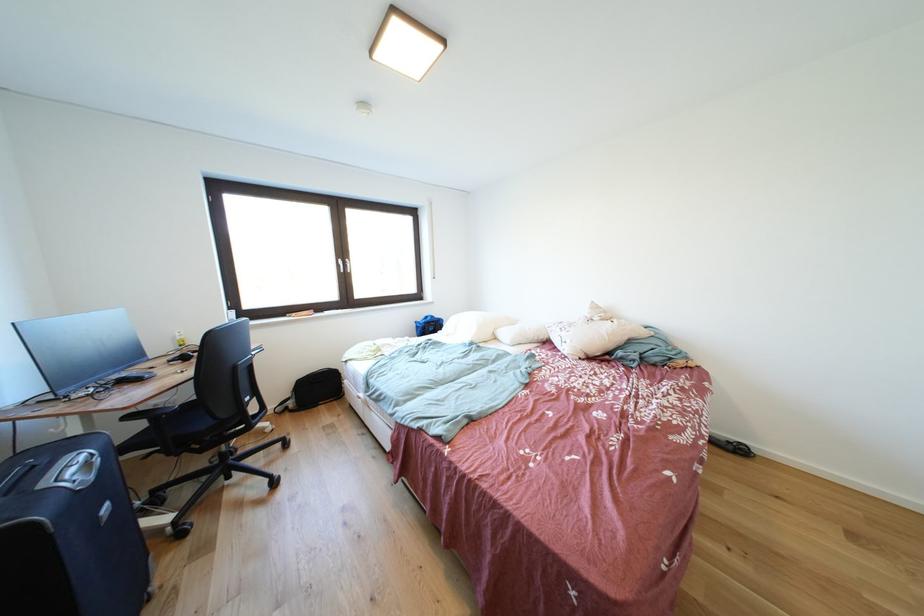
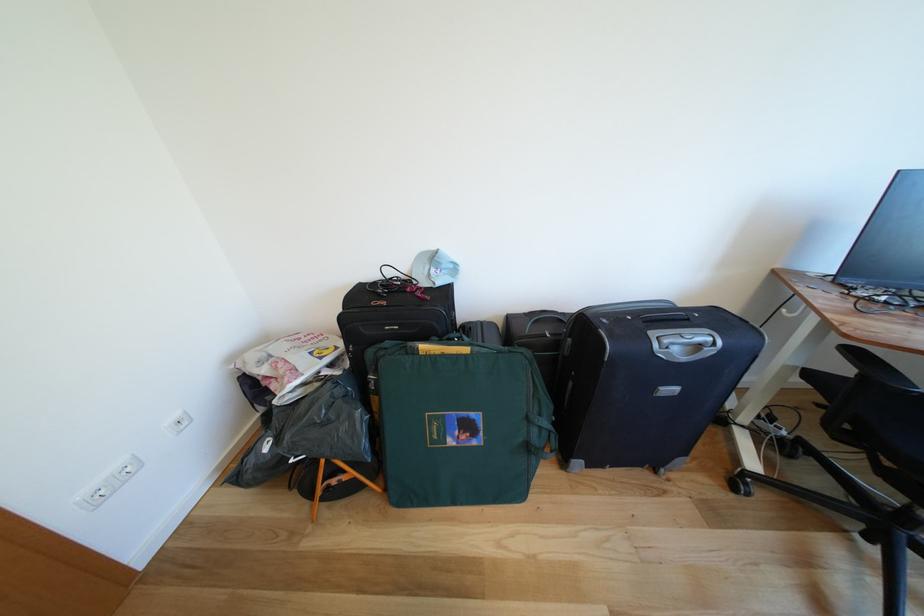
Locate, in the second image, the point that corresponds to the point at 94,468 in the first image.

(707, 351)